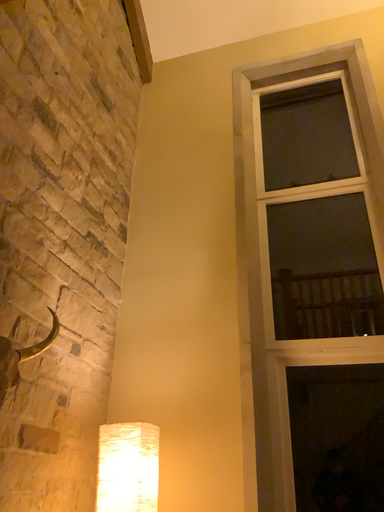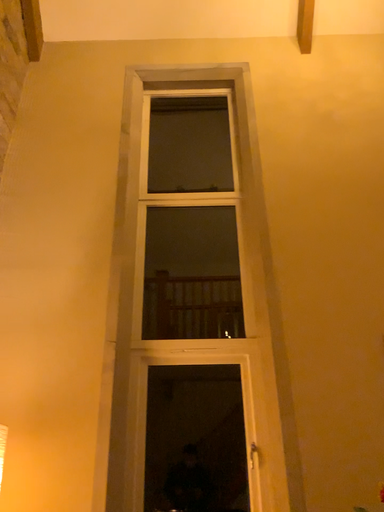
Question: How did the camera likely rotate when shooting the video?

Choices:
 (A) rotated right
 (B) rotated left

Answer: (A)